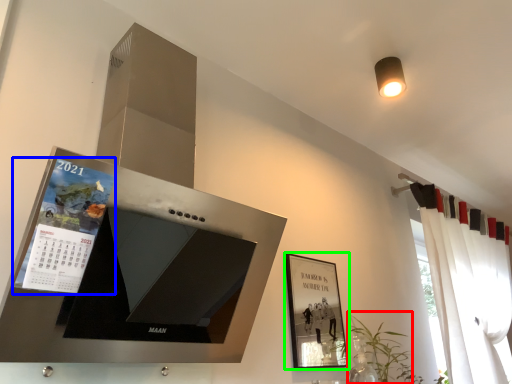
Question: Based on their relative distances, which object is nearer to plant (highlighted by a red box)? Choose from magazine (highlighted by a blue box) and picture frame (highlighted by a green box).

Choices:
 (A) magazine
 (B) picture frame

Answer: (B)